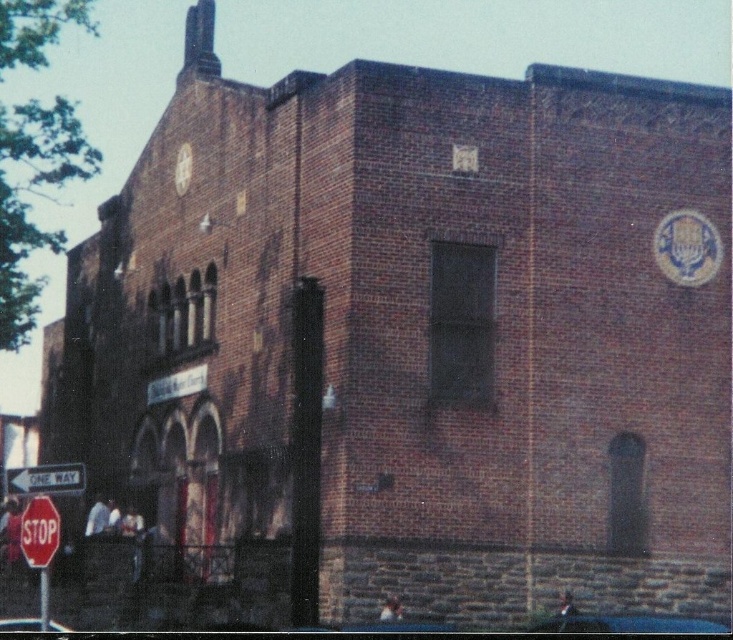
Is red glossy stop sign at lower left above white plastic one way sign at lower left?

No.

Which is above, red glossy stop sign at lower left or white plastic one way sign at lower left?

white plastic one way sign at lower left is above.

Does point (40, 554) come closer to viewer compared to point (7, 484)?

Yes.

Image resolution: width=733 pixels, height=640 pixels. I want to click on red glossy stop sign at lower left, so click(x=40, y=531).